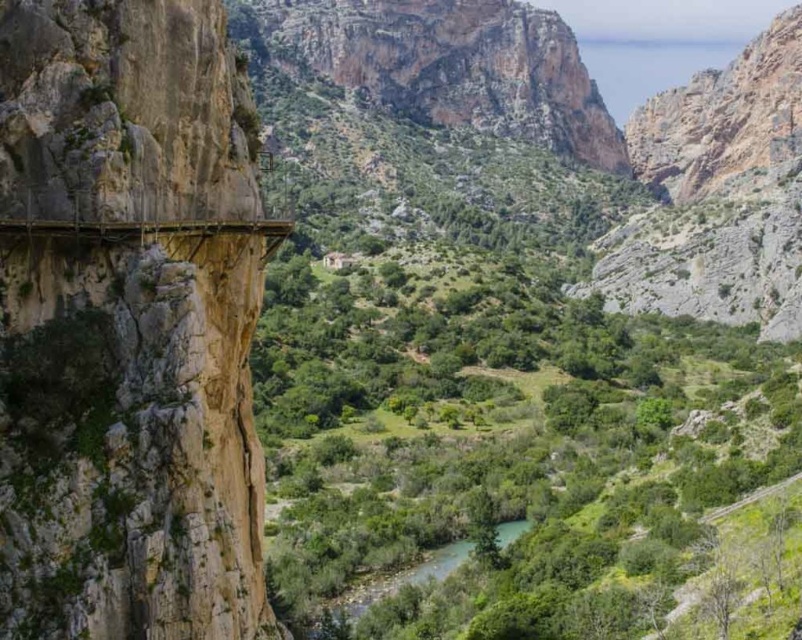
Can you confirm if rough stone bridge at left is positioned below green smooth river at center?

Incorrect, rough stone bridge at left is not positioned below green smooth river at center.

Does point (23, 353) lie in front of point (361, 593)?

Yes.

Find the location of `rough stone bridge at left`. rough stone bridge at left is located at coordinates (128, 324).